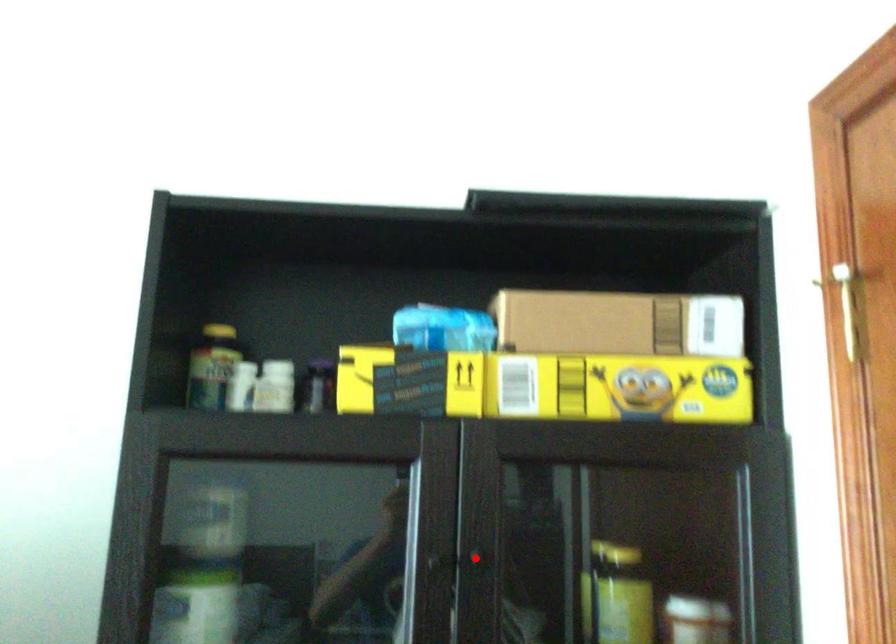
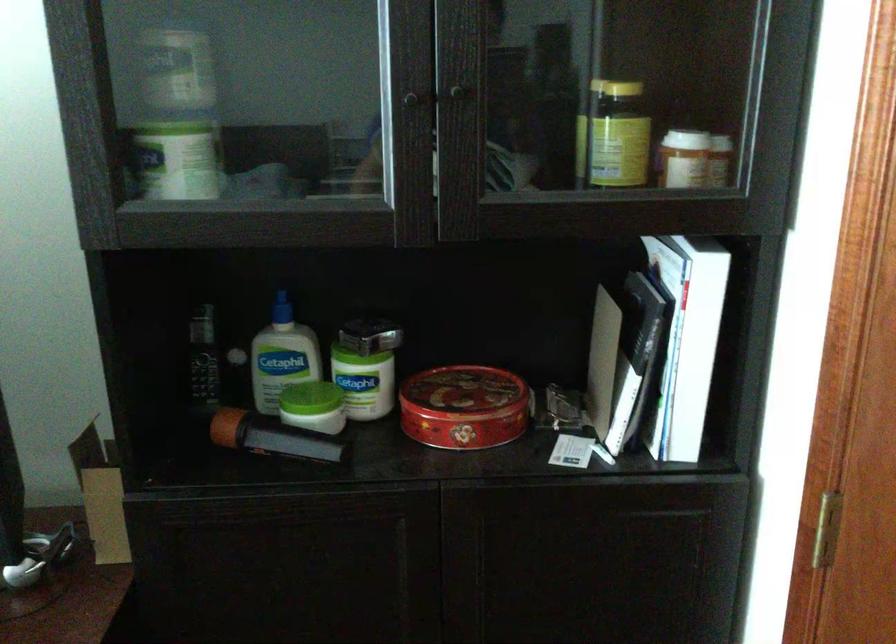
Locate, in the second image, the point that corresponds to the highlighted location in the first image.

(454, 91)